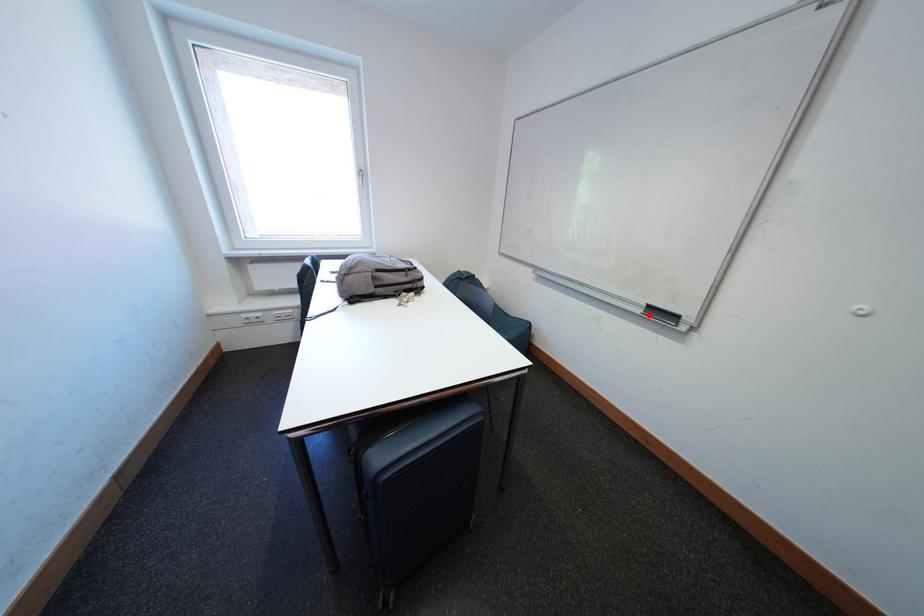
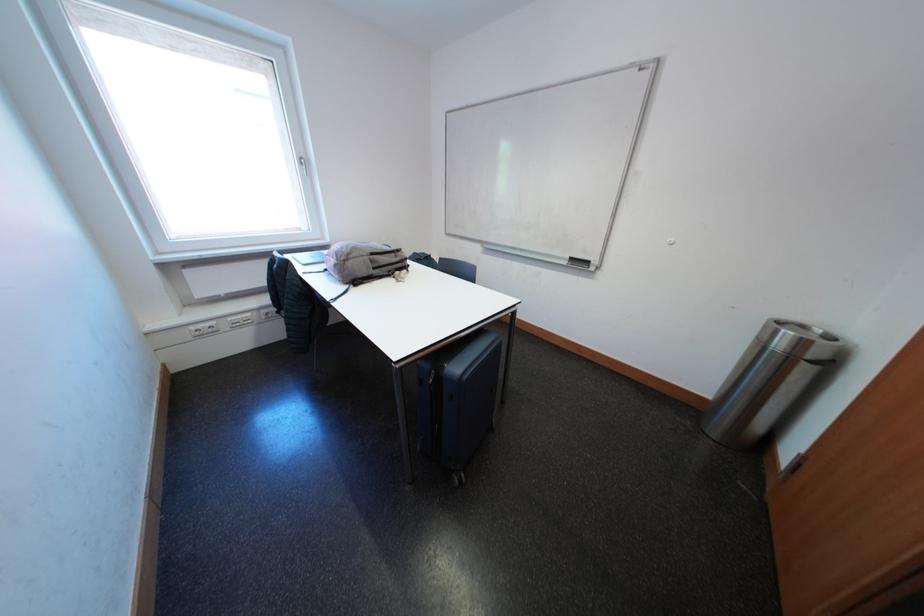
Locate, in the second image, the point that corresponds to the highlighted location in the first image.

(575, 267)